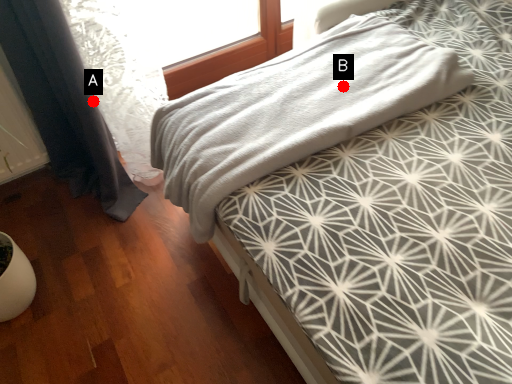
Question: Two points are circled on the image, labeled by A and B beside each circle. Among these points, which one is farthest from the camera?

Choices:
 (A) A is further
 (B) B is further

Answer: (A)